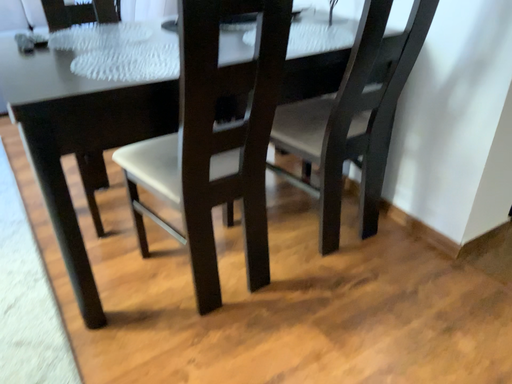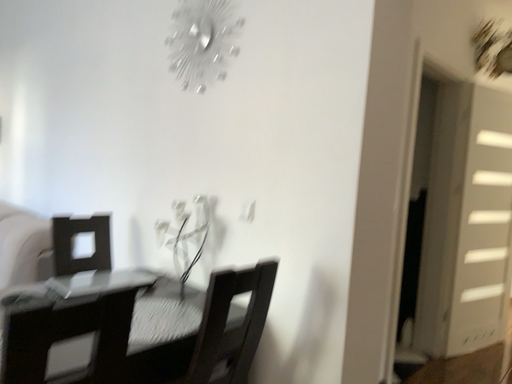
Question: Which way did the camera rotate in the video?

Choices:
 (A) rotated downward
 (B) rotated upward

Answer: (B)